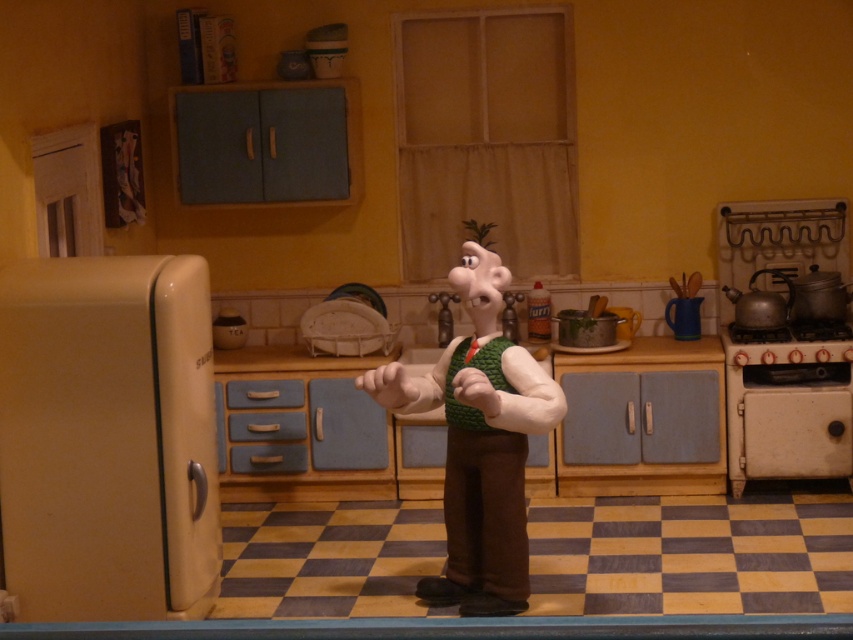
Question: Which point appears farthest from the camera in this image?

Choices:
 (A) (68, 490)
 (B) (544, 417)

Answer: (A)

Question: From the image, what is the correct spatial relationship of beige matte refrigerator at left in relation to green knitted vest at center?

Choices:
 (A) above
 (B) below

Answer: (B)

Question: Where is beige matte refrigerator at left located in relation to green knitted vest at center in the image?

Choices:
 (A) left
 (B) right

Answer: (A)

Question: Which point appears closest to the camera in this image?

Choices:
 (A) (456, 358)
 (B) (138, 596)

Answer: (B)

Question: Observing the image, what is the correct spatial positioning of beige matte refrigerator at left in reference to green knitted vest at center?

Choices:
 (A) above
 (B) below

Answer: (B)